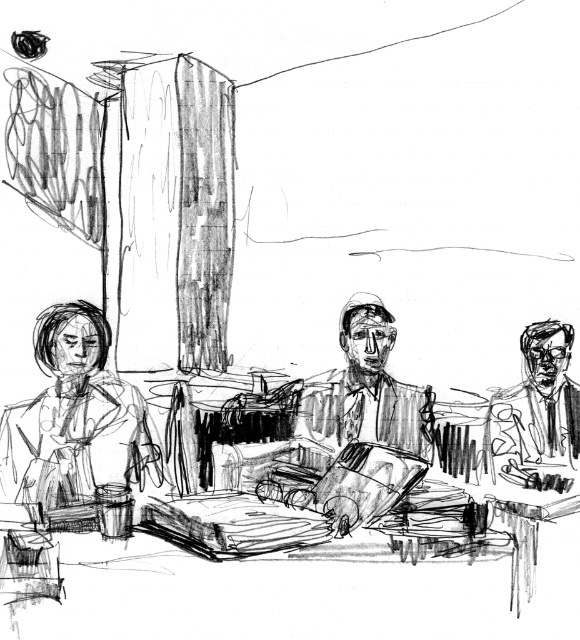
In the image, there are two people wearing the smooth brown leather jacket at center and the smooth black suit at right. Which one is positioned to the left?

The smooth brown leather jacket at center is positioned to the left of the smooth black suit at right.

Based on the scene described, which object is positioned to the left of the other between the smooth skin woman at left and the smooth brown leather jacket at center?

The smooth skin woman at left is positioned to the left of the smooth brown leather jacket at center.

Based on the scene description, what object is located at the coordinates point (365,390)?

The point (365,390) corresponds to the smooth brown leather jacket at center.